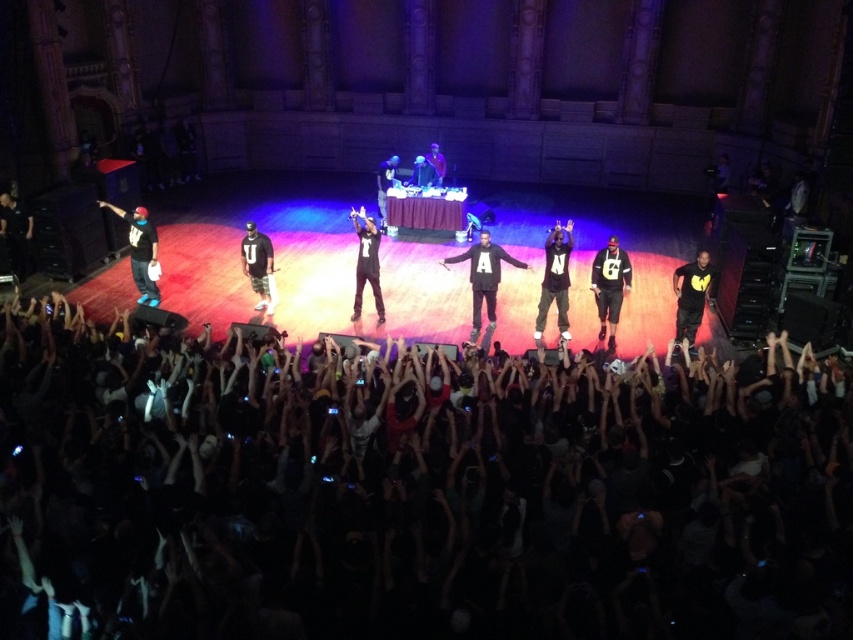
You are a photographer at the concert and want to capture both the black matte sweatshirt at center and the black matte shirt at right in a single photo. Which clothing item will appear taller in the photo?

The black matte sweatshirt at center will appear taller in the photo since it has a greater height compared to the black matte shirt at right according to the description.

You are standing in the front row of the concert. You want to grab a black matte jacket at left located at point (16, 234). Is there enough space between you and the stage to do so?

The black matte jacket at left is located at point (16, 234). Since the performers are on stage and the crowd is densely packed, there might not be enough space to reach the jacket safely. Please check the area carefully before moving.